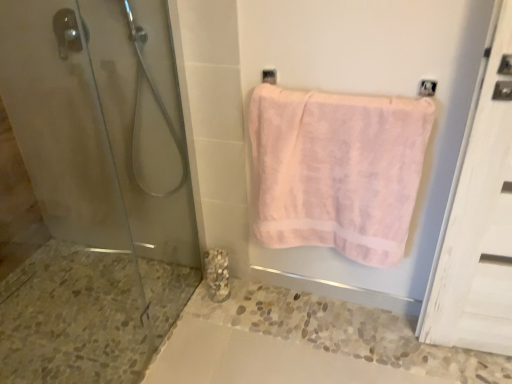
Image resolution: width=512 pixels, height=384 pixels. What are the coordinates of `vacant area that is in front of marble textured at lower left` in the screenshot? It's located at (217, 323).